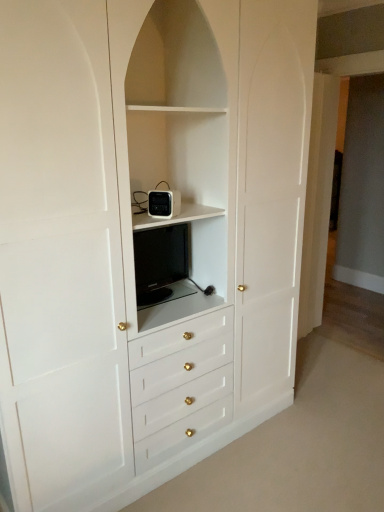
In order to face satin black tv at center, should I rotate leftwards or rightwards?

To face it directly, rotate left by 5.039 degrees.

This screenshot has height=512, width=384. What do you see at coordinates (159, 262) in the screenshot?
I see `satin black tv at center` at bounding box center [159, 262].

This screenshot has width=384, height=512. Find the location of `satin black tv at center`. satin black tv at center is located at coordinates (159, 262).

Image resolution: width=384 pixels, height=512 pixels. In order to click on satin black tv at center in this screenshot , I will do `click(159, 262)`.